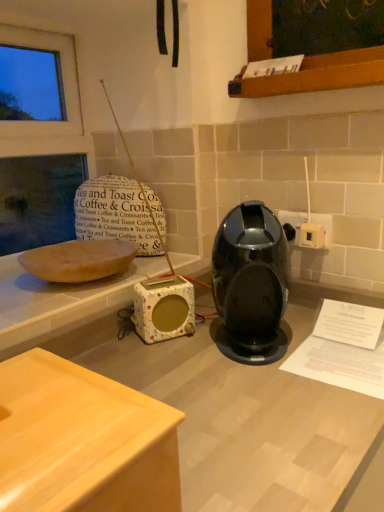
The height and width of the screenshot is (512, 384). Describe the element at coordinates (312, 234) in the screenshot. I see `white plastic electric outlet at right, arranged as the 2th electric outlet when viewed from the back` at that location.

You are a GUI agent. You are given a task and a screenshot of the screen. Output one action in this format:
    pyautogui.click(x=<x>, y=<y>)
    Task: Click on the white fabric-covered speaker at center
    The height and width of the screenshot is (512, 384).
    Given the screenshot: What is the action you would take?
    pyautogui.click(x=163, y=309)

You are a GUI agent. You are given a task and a screenshot of the screen. Output one action in this format:
    pyautogui.click(x=<x>, y=<y>)
    Task: Click on the wooden at lower left
    The image size is (384, 512).
    Given the screenshot: What is the action you would take?
    pyautogui.click(x=82, y=441)

I want to click on white plastic electric outlet at right, arranged as the 2th electric outlet when viewed from the back, so click(x=312, y=234).

Does wooden at lower left have a lesser height compared to white fabric-covered speaker at center?

Incorrect, the height of wooden at lower left does not fall short of that of white fabric-covered speaker at center.

Considering the sizes of objects wooden at lower left and white fabric-covered speaker at center in the image provided, who is bigger, wooden at lower left or white fabric-covered speaker at center?

Bigger between the two is wooden at lower left.

Does wooden at lower left lie behind white fabric-covered speaker at center?

No, wooden at lower left is closer to the camera.

Could white fabric-covered speaker at center be considered to be inside wooden at lower left?

That's incorrect, white fabric-covered speaker at center is not inside wooden at lower left.

Does white plastic electric outlet at right, the second electric outlet from the front, turn towards wooden at lower left?

Yes, white plastic electric outlet at right, the second electric outlet from the front, faces towards wooden at lower left.

Is wooden at lower left located within white plastic electric outlet at right, the second electric outlet from the front?

No, wooden at lower left is located outside of white plastic electric outlet at right, the second electric outlet from the front.

Based on the photo, from a real-world perspective, is white plastic electric outlet at right, which is counted as the first electric outlet, starting from the back, positioned over wooden at lower left based on gravity?

Yes.

Which is in front, white plastic electric outlet at right, the second electric outlet from the front, or wooden at lower left?

wooden at lower left is closer to the camera.

Would you consider white plastic electric outlet at right, the 1th electric outlet when ordered from front to back, to be distant from wooden at lower left?

No, white plastic electric outlet at right, the 1th electric outlet when ordered from front to back, is not far away from wooden at lower left.

How distant is white plastic electric outlet at right, arranged as the 2th electric outlet when viewed from the back, from wooden at lower left?

The distance of white plastic electric outlet at right, arranged as the 2th electric outlet when viewed from the back, from wooden at lower left is 31.71 inches.

From a real-world perspective, is white plastic electric outlet at right, the 1th electric outlet when ordered from front to back, located higher than wooden at lower left?

Yes, from a real-world perspective, white plastic electric outlet at right, the 1th electric outlet when ordered from front to back, is over wooden at lower left

Looking at this image, can you tell me how much wooden at lower left and glossy plastic coffee machine at center differ in facing direction?

The angle between the facing direction of wooden at lower left and the facing direction of glossy plastic coffee machine at center is 55.1 degrees.

Does wooden at lower left have a lesser width compared to glossy plastic coffee machine at center?

Yes.

Is wooden at lower left situated inside glossy plastic coffee machine at center or outside?

wooden at lower left is not inside glossy plastic coffee machine at center, it's outside.

How distant is wooden at lower left from glossy plastic coffee machine at center?

wooden at lower left and glossy plastic coffee machine at center are 50.74 centimeters apart.

Find the location of a particular element. This screenshot has width=384, height=512. home appliance in front of the white fabric-covered speaker at center is located at coordinates (251, 285).

Is white fabric-covered speaker at center facing away from glossy plastic coffee machine at center?

No, white fabric-covered speaker at center is not facing the opposite direction of glossy plastic coffee machine at center.

Between white fabric-covered speaker at center and glossy plastic coffee machine at center, which one appears on the left side from the viewer's perspective?

white fabric-covered speaker at center.

Does white fabric-covered speaker at center contain glossy plastic coffee machine at center?

No, glossy plastic coffee machine at center is not inside white fabric-covered speaker at center.

From the picture: Considering their positions, is wooden at lower left located in front of or behind white plastic electric outlet at right, which is counted as the first electric outlet, starting from the back?

In the image, wooden at lower left appears in front of white plastic electric outlet at right, which is counted as the first electric outlet, starting from the back.

Would you say wooden at lower left contains white plastic electric outlet at right, which is counted as the first electric outlet, starting from the back?

No, white plastic electric outlet at right, which is counted as the first electric outlet, starting from the back, is not surrounded by wooden at lower left.

Considering the sizes of wooden at lower left and white plastic electric outlet at right, which is counted as the first electric outlet, starting from the back, in the image, is wooden at lower left wider or thinner than white plastic electric outlet at right, which is counted as the first electric outlet, starting from the back,?

wooden at lower left is wider than white plastic electric outlet at right, which is counted as the first electric outlet, starting from the back.

Is white plastic electric outlet at right, arranged as the 2th electric outlet when viewed from the back, oriented towards white plastic electric outlet at right, which is counted as the first electric outlet, starting from the back?

No, white plastic electric outlet at right, arranged as the 2th electric outlet when viewed from the back, is not turned towards white plastic electric outlet at right, which is counted as the first electric outlet, starting from the back.

Is white plastic electric outlet at right, the 1th electric outlet when ordered from front to back, far away from white plastic electric outlet at right, the second electric outlet from the front?

No.

Considering their positions, is white plastic electric outlet at right, arranged as the 2th electric outlet when viewed from the back, located in front of or behind white plastic electric outlet at right, the second electric outlet from the front?

Visually, white plastic electric outlet at right, arranged as the 2th electric outlet when viewed from the back, is located in front of white plastic electric outlet at right, the second electric outlet from the front.

Locate an element on the screen. The width and height of the screenshot is (384, 512). table on the left of white fabric-covered speaker at center is located at coordinates (82, 441).

Image resolution: width=384 pixels, height=512 pixels. I want to click on table that appears below the white plastic electric outlet at right, which is counted as the first electric outlet, starting from the back (from a real-world perspective), so click(82, 441).

Which object lies further to the anchor point white fabric-covered speaker at center, glossy plastic coffee machine at center or white plastic electric outlet at right, arranged as the 2th electric outlet when viewed from the back?

The object further to white fabric-covered speaker at center is white plastic electric outlet at right, arranged as the 2th electric outlet when viewed from the back.

Consider the image. From the image, which object appears to be nearer to white plastic electric outlet at right, the 1th electric outlet when ordered from front to back, glossy plastic coffee machine at center or white plastic electric outlet at right, the second electric outlet from the front?

Among the two, white plastic electric outlet at right, the second electric outlet from the front, is located nearer to white plastic electric outlet at right, the 1th electric outlet when ordered from front to back.

Estimate the real-world distances between objects in this image. Which object is closer to glossy plastic coffee machine at center, wooden at lower left or white fabric-covered speaker at center?

The object closer to glossy plastic coffee machine at center is white fabric-covered speaker at center.

When comparing their distances from wooden at lower left, does glossy plastic coffee machine at center or white plastic electric outlet at right, which is counted as the first electric outlet, starting from the back, seem further?

white plastic electric outlet at right, which is counted as the first electric outlet, starting from the back, is further to wooden at lower left.

When comparing their distances from white fabric-covered speaker at center, does white plastic electric outlet at right, arranged as the 2th electric outlet when viewed from the back, or wooden at lower left seem further?

Based on the image, wooden at lower left appears to be further to white fabric-covered speaker at center.

Estimate the real-world distances between objects in this image. Which object is closer to glossy plastic coffee machine at center, white fabric-covered speaker at center or wooden at lower left?

The object closer to glossy plastic coffee machine at center is white fabric-covered speaker at center.

Looking at the image, which one is located closer to wooden at lower left, white plastic electric outlet at right, arranged as the 2th electric outlet when viewed from the back, or white fabric-covered speaker at center?

white fabric-covered speaker at center lies closer to wooden at lower left than the other object.

Which object lies nearer to the anchor point white fabric-covered speaker at center, glossy plastic coffee machine at center or white plastic electric outlet at right, the second electric outlet from the front?

The object closer to white fabric-covered speaker at center is glossy plastic coffee machine at center.

Find the location of a particular element. The height and width of the screenshot is (512, 384). appliance between wooden at lower left and white plastic electric outlet at right, which is counted as the first electric outlet, starting from the back, in the front-back direction is located at coordinates (163, 309).

Image resolution: width=384 pixels, height=512 pixels. Identify the location of electric outlet between white fabric-covered speaker at center and white plastic electric outlet at right, arranged as the 2th electric outlet when viewed from the back. (292, 220).

Locate an element on the screen. The height and width of the screenshot is (512, 384). home appliance located between white fabric-covered speaker at center and white plastic electric outlet at right, the 1th electric outlet when ordered from front to back, in the left-right direction is located at coordinates pyautogui.click(x=251, y=285).

Locate an element on the screen. This screenshot has height=512, width=384. home appliance between white fabric-covered speaker at center and white plastic electric outlet at right, which is counted as the first electric outlet, starting from the back, from left to right is located at coordinates pos(251,285).